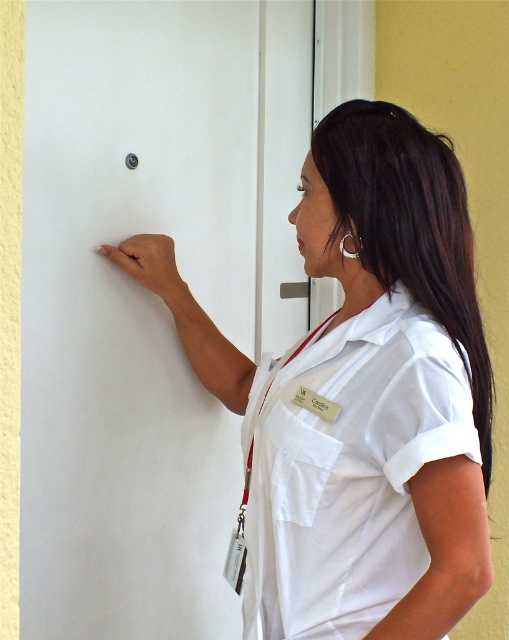
Question: Estimate the real-world distances between objects in this image. Which object is farther from the white smooth scrub at center?

Choices:
 (A) white smooth shirt at center
 (B) metallic silver door handle at center
 (C) satin silver door handle at upper center

Answer: (B)

Question: Is metallic silver door handle at center in front of satin silver door handle at upper center?

Choices:
 (A) no
 (B) yes

Answer: (A)

Question: Does white matte door at center come behind white smooth scrub at center?

Choices:
 (A) yes
 (B) no

Answer: (A)

Question: Which object is closer to the camera taking this photo?

Choices:
 (A) metallic silver door handle at center
 (B) white matte door at center

Answer: (B)

Question: Which is nearer to the white smooth scrub at center?

Choices:
 (A) satin silver door handle at upper center
 (B) metallic silver door handle at center
 (C) white smooth shirt at center

Answer: (C)

Question: Where is white smooth scrub at center located in relation to satin silver door handle at upper center in the image?

Choices:
 (A) left
 (B) right

Answer: (B)